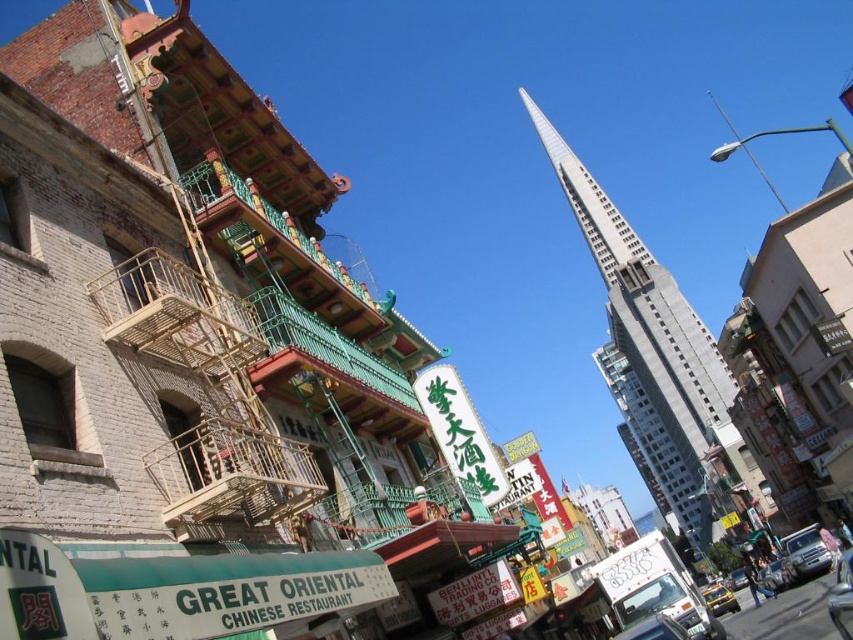
Which of these two, silver metallic car at lower right or metallic silver car at center, stands taller?

metallic silver car at center

Can you confirm if silver metallic car at lower right is positioned to the right of metallic silver car at center?

No, silver metallic car at lower right is not to the right of metallic silver car at center.

Is point (785, 538) farther from viewer compared to point (744, 573)?

No, (785, 538) is closer to viewer.

This screenshot has width=853, height=640. I want to click on silver metallic car at lower right, so click(x=804, y=552).

Measure the distance between gray concrete tower at center and camera.

gray concrete tower at center is 211.48 meters from camera.

Does gray concrete tower at center have a greater width compared to metallic silver car at center?

Indeed, gray concrete tower at center has a greater width compared to metallic silver car at center.

Which is behind, point (650, 369) or point (740, 582)?

Positioned behind is point (650, 369).

Locate an element on the screen. The height and width of the screenshot is (640, 853). gray concrete tower at center is located at coordinates (648, 344).

Between silver metallic car at lower right and yellow matte taxi at lower right, which one is positioned higher?

Positioned higher is silver metallic car at lower right.

Is point (824, 566) in front of point (712, 589)?

Yes, point (824, 566) is in front of point (712, 589).

Who is more distant from viewer, (x=807, y=541) or (x=720, y=596)?

The point (x=720, y=596) is behind.

Image resolution: width=853 pixels, height=640 pixels. I want to click on silver metallic car at lower right, so click(x=804, y=552).